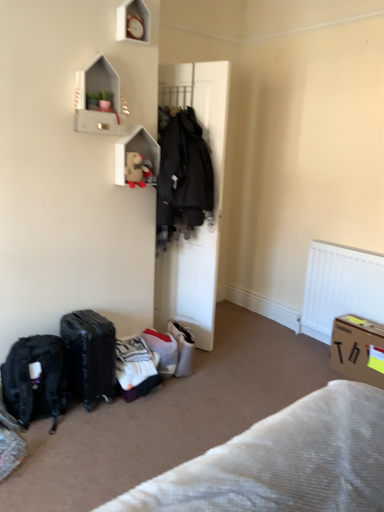
This screenshot has height=512, width=384. In order to click on free space to the left of cardboard box at lower right in this screenshot , I will do `click(311, 372)`.